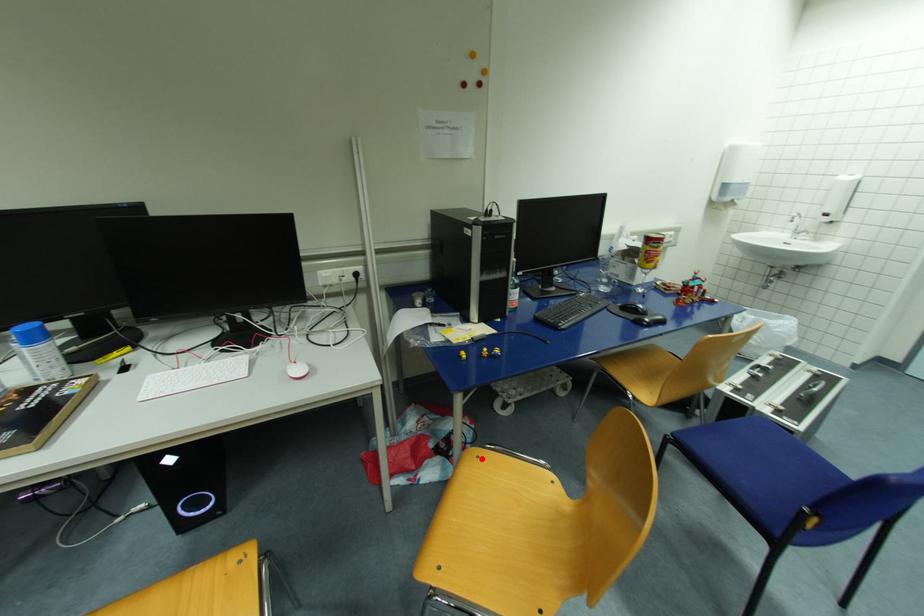
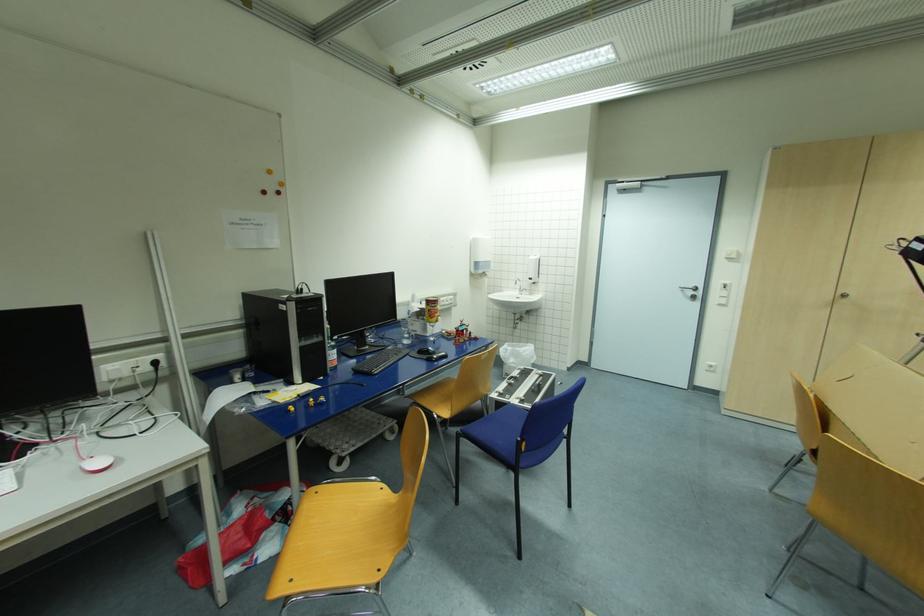
The point at the highlighted location is marked in the first image. Where is the corresponding point in the second image?

(320, 493)